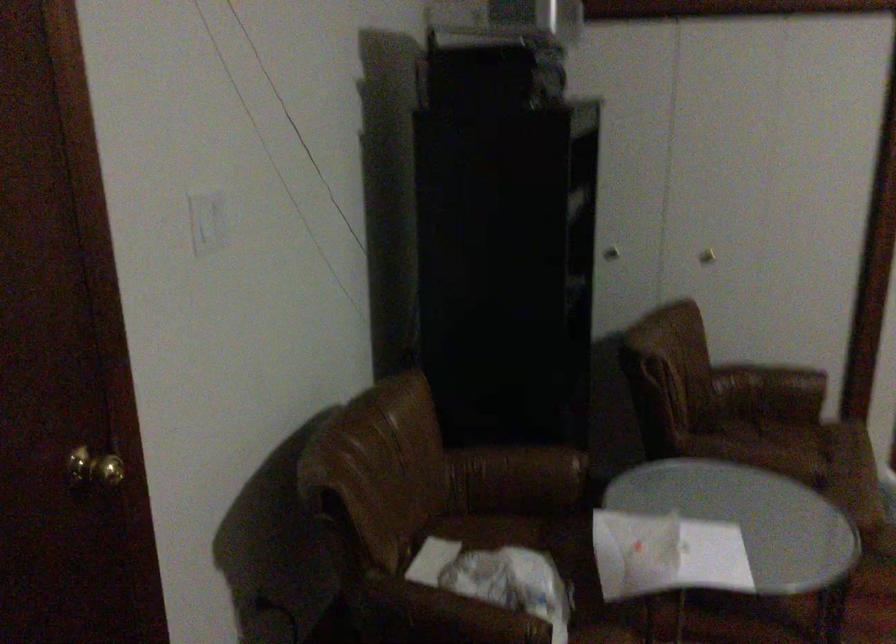
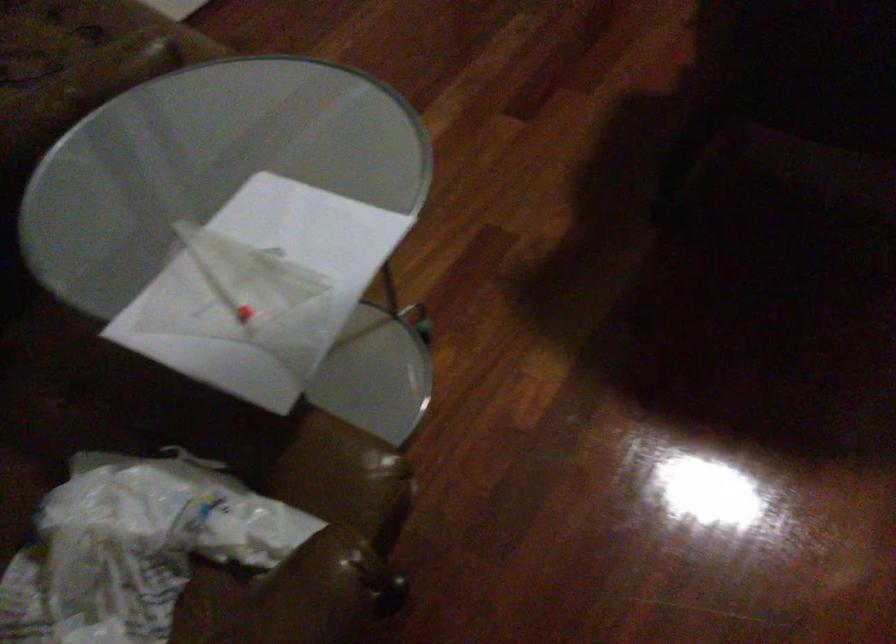
The first image is from the beginning of the video and the second image is from the end. How did the camera likely rotate when shooting the video?

The camera's rotation is toward right-down.